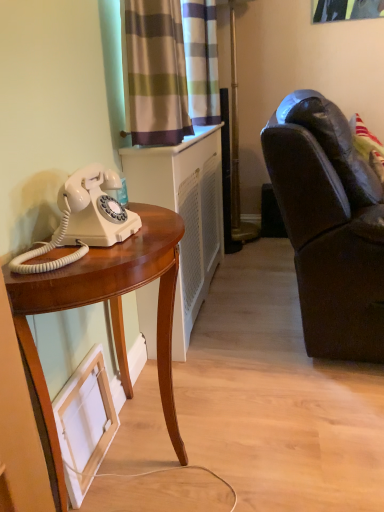
The height and width of the screenshot is (512, 384). I want to click on vacant space in front of white matte picture frame at lower left, so click(106, 492).